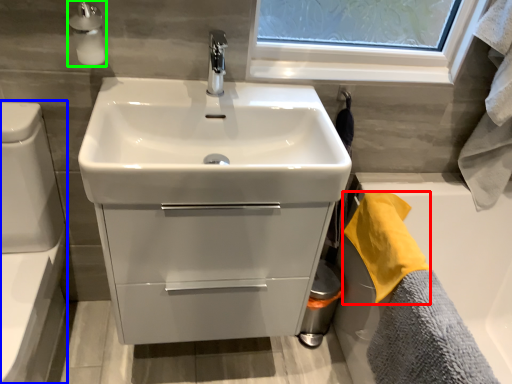
Question: Estimate the real-world distances between objects in this image. Which object is closer to bath towel (highlighted by a red box), toilet bowl (highlighted by a blue box) or soap dispenser (highlighted by a green box)?

Choices:
 (A) toilet bowl
 (B) soap dispenser

Answer: (B)